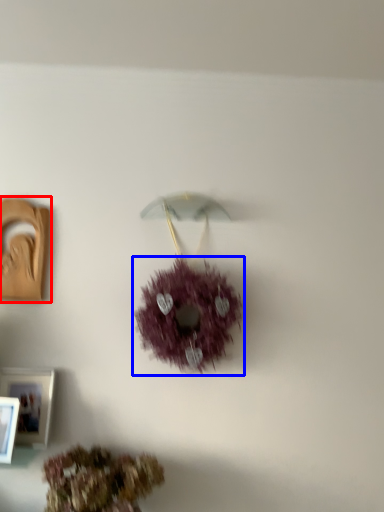
Question: Which of the following is the closest to the observer, picture frame (highlighted by a red box) or flower (highlighted by a blue box)?

Choices:
 (A) picture frame
 (B) flower

Answer: (B)